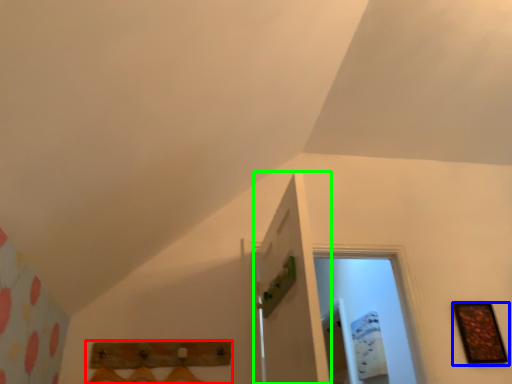
Question: Which object is the farthest from furniture (highlighted by a red box)? Choose among these: picture frame (highlighted by a blue box) or door (highlighted by a green box).

Choices:
 (A) picture frame
 (B) door

Answer: (A)